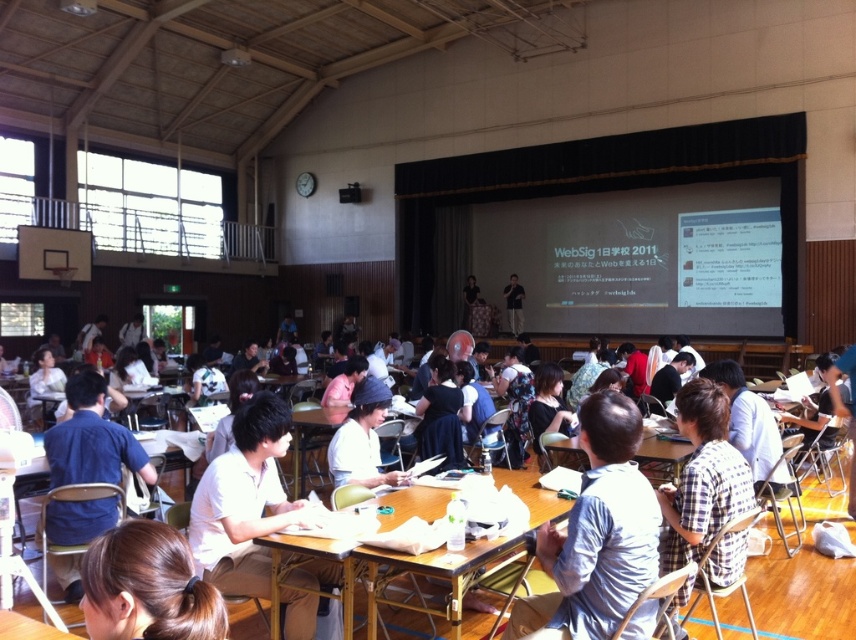
Question: From the image, what is the correct spatial relationship of blue shirt at left in relation to wooden table at center?

Choices:
 (A) left
 (B) right

Answer: (A)

Question: Does white shirt at center appear under dark gray shirt at center?

Choices:
 (A) no
 (B) yes

Answer: (B)

Question: Among these points, which one is farthest from the camera?

Choices:
 (A) (687, 268)
 (B) (521, 332)
 (C) (657, 570)

Answer: (B)

Question: Which of the following is the closest to the observer?

Choices:
 (A) (598, 579)
 (B) (397, 506)

Answer: (A)

Question: Based on their relative distances, which object is farther from the white matte shirt at center?

Choices:
 (A) brown hair at lower left
 (B) dark gray shirt at center

Answer: (B)

Question: Is brown hair at lower left wider than white fabric cap at center?

Choices:
 (A) no
 (B) yes

Answer: (A)